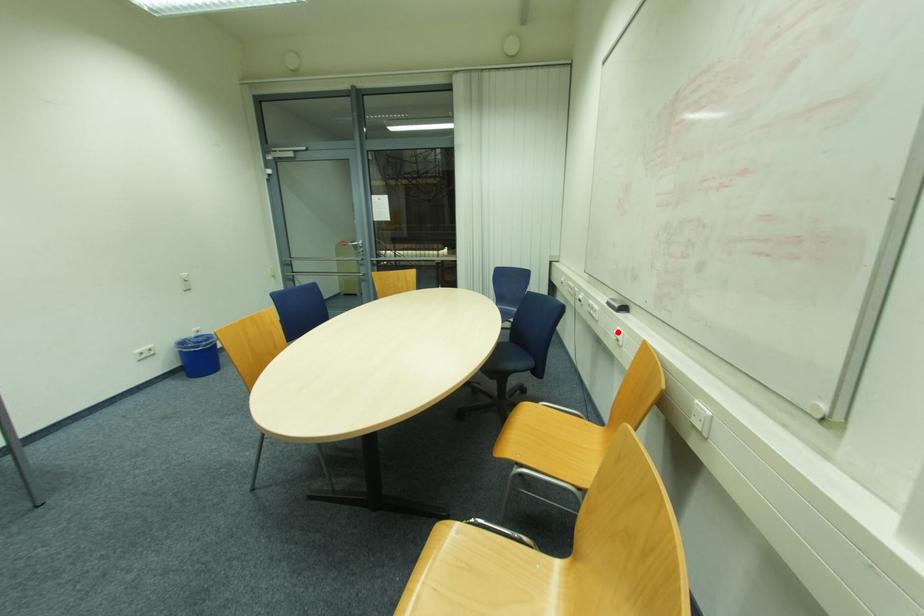
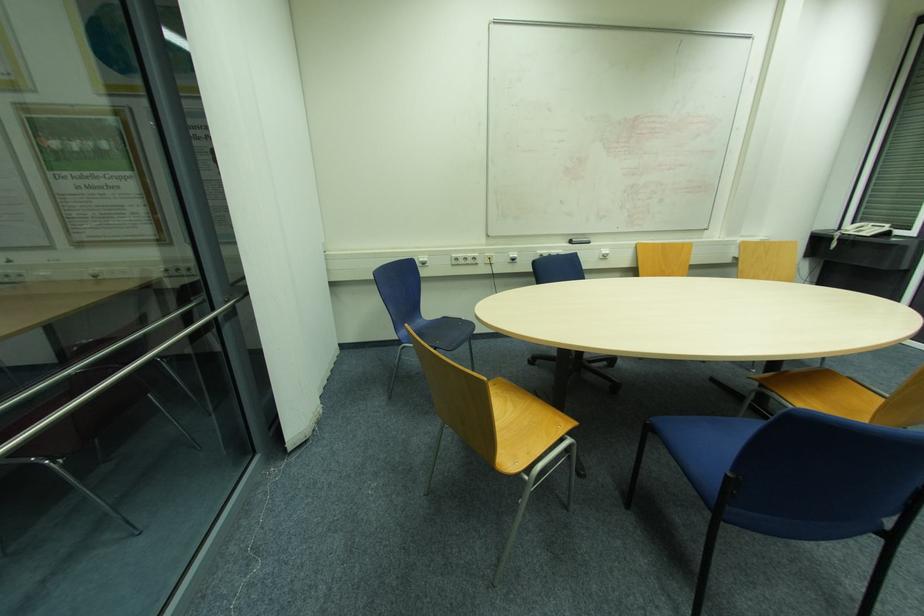
Find the pixel in the second image that matches the highlighted location in the first image.

(604, 253)